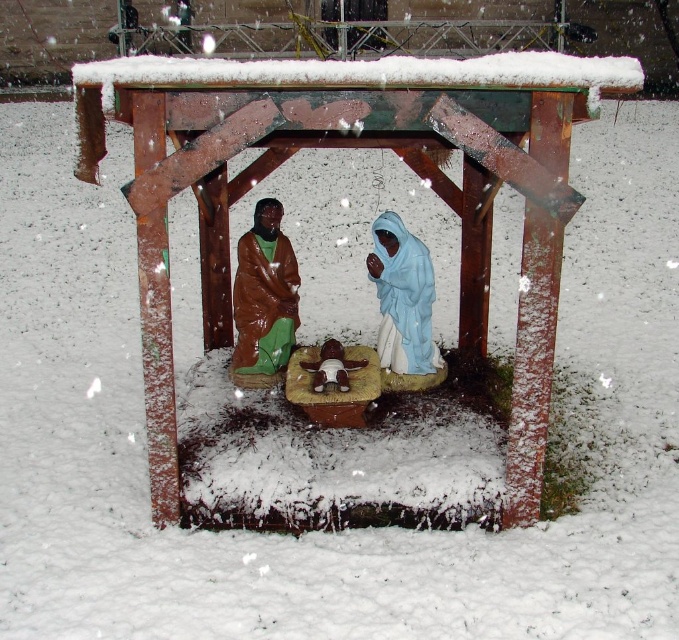
Locate an element on the screen. light blue fabric at center is located at coordinates (403, 298).

Describe the element at coordinates (403, 298) in the screenshot. I see `light blue fabric at center` at that location.

Between point (409, 282) and point (293, 323), which one is positioned in front?

Point (409, 282)

I want to click on light blue fabric at center, so click(x=403, y=298).